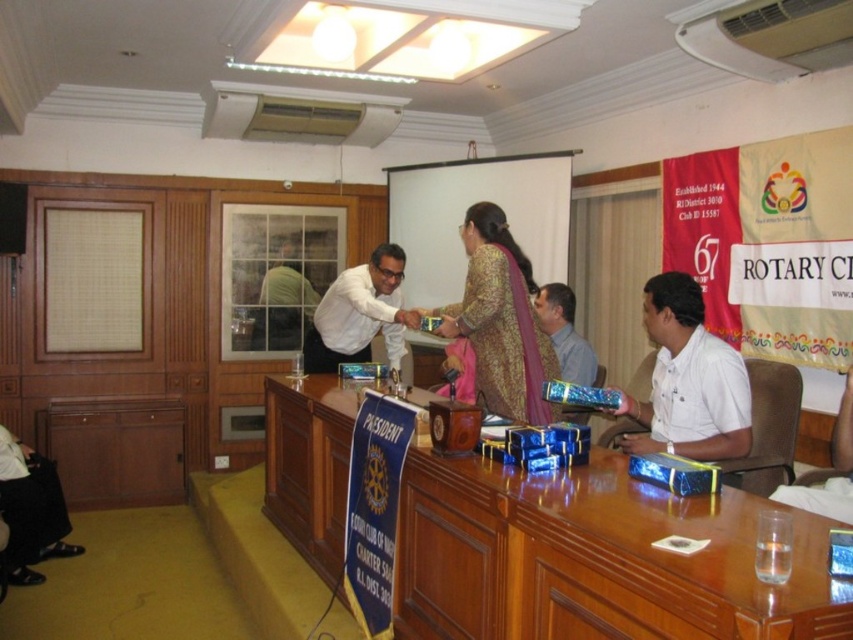
Question: Is white cotton shirt at right bigger than gold brocade dress at center?

Choices:
 (A) no
 (B) yes

Answer: (A)

Question: Which object is farther from the camera taking this photo?

Choices:
 (A) green fabric at center
 (B) gold brocade dress at center

Answer: (A)

Question: Does white cotton shirt at right lie in front of white glossy shirt at center?

Choices:
 (A) yes
 (B) no

Answer: (A)

Question: Is wooden table at center positioned in front of gold brocade dress at center?

Choices:
 (A) no
 (B) yes

Answer: (B)

Question: Among these points, which one is nearest to the camera?

Choices:
 (A) (393, 310)
 (B) (718, 358)

Answer: (B)

Question: Which point is closer to the camera taking this photo?

Choices:
 (A) (532, 282)
 (B) (712, 392)
 (C) (331, 438)
 (D) (369, 358)

Answer: (B)